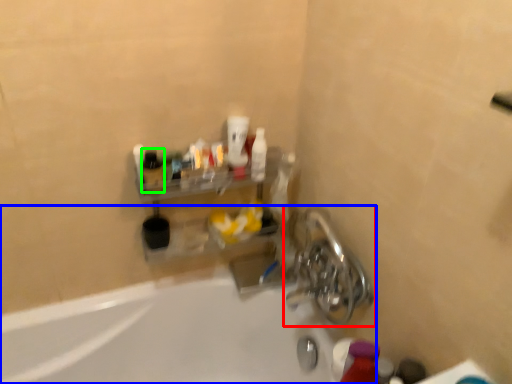
Question: Based on their relative distances, which object is nearer to tap (highlighted by a red box)? Choose from bathtub (highlighted by a blue box) and bottle (highlighted by a green box).

Choices:
 (A) bathtub
 (B) bottle

Answer: (A)